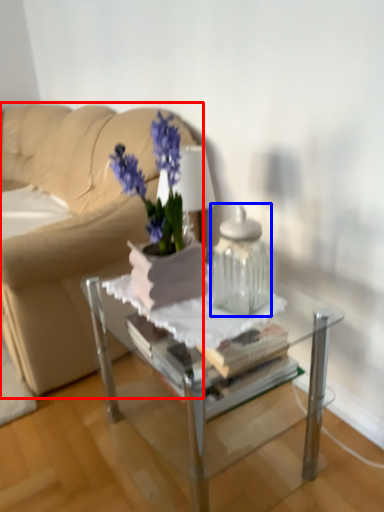
Question: Among these objects, which one is farthest to the camera, studio couch (highlighted by a red box) or vase (highlighted by a blue box)?

Choices:
 (A) studio couch
 (B) vase

Answer: (A)